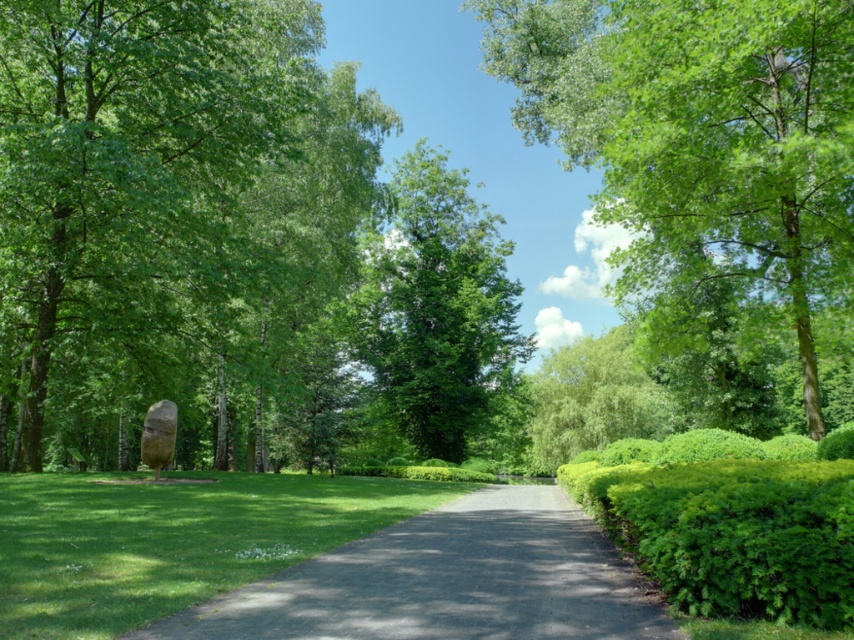
Is point (208, 390) positioned in front of point (214, 529)?

No, (208, 390) is behind (214, 529).

Identify the location of green leafy tree at left. This screenshot has height=640, width=854. point(174,225).

Where is `green leafy tree at left`? green leafy tree at left is located at coordinates (174, 225).

Is point (577, 12) more distant than point (449, 177)?

No.

How far apart are green leafy tree at upper center and green leafy tree at center?

green leafy tree at upper center and green leafy tree at center are 20.67 meters apart from each other.

Between point (610, 44) and point (442, 436), which one is positioned behind?

The point (442, 436) is behind.

The image size is (854, 640). In order to click on green leafy tree at upper center in this screenshot , I will do `click(699, 125)`.

Between green leafy hedge at right and green leafy tree at center, which one has less height?

With less height is green leafy hedge at right.

Can you confirm if green leafy hedge at right is wider than green leafy tree at center?

In fact, green leafy hedge at right might be narrower than green leafy tree at center.

You are a GUI agent. You are given a task and a screenshot of the screen. Output one action in this format:
    pyautogui.click(x=<x>, y=<y>)
    Task: Click on the green leafy hedge at right
    
    Given the screenshot: What is the action you would take?
    (730, 520)

Find the location of a particular element. This screenshot has height=640, width=854. green leafy hedge at right is located at coordinates (730, 520).